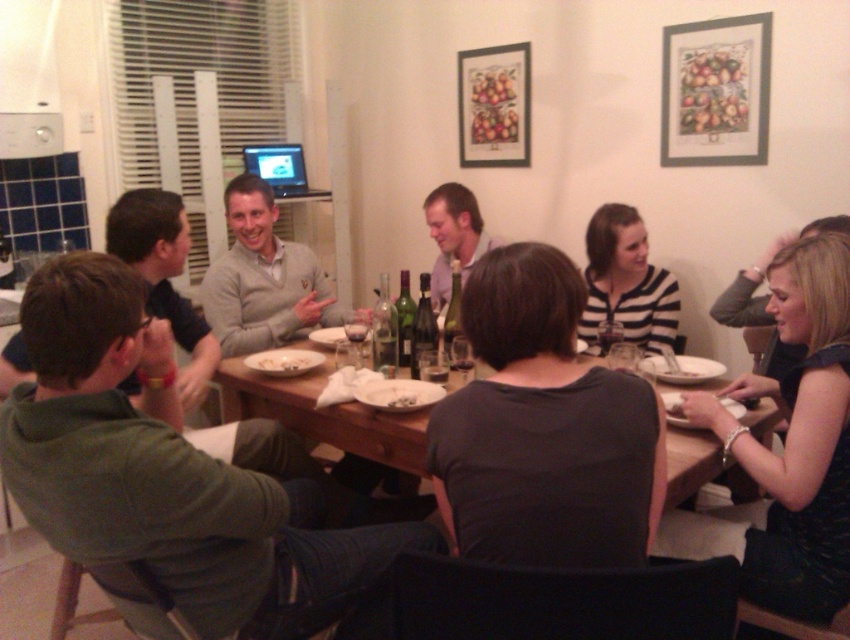
Question: Is the position of black dress at lower right more distant than that of striped cotton shirt at center?

Choices:
 (A) no
 (B) yes

Answer: (A)

Question: Which of these objects is positioned closest to the white matte plate at center?

Choices:
 (A) green cotton shirt at left
 (B) black dress at lower right

Answer: (A)

Question: From the image, what is the correct spatial relationship of gray sweater at center in relation to green matte shirt at left?

Choices:
 (A) below
 (B) above

Answer: (B)

Question: Estimate the real-world distances between objects in this image. Which object is closer to the white paper plate at center?

Choices:
 (A) green matte shirt at left
 (B) dark gray shirt at center
 (C) green cotton shirt at lower left

Answer: (C)

Question: Estimate the real-world distances between objects in this image. Which object is farther from the white matte plate at center?

Choices:
 (A) dark gray shirt at center
 (B) wooden framed print at upper right

Answer: (B)

Question: Can you confirm if wooden framed print at upper right is positioned to the left of striped cotton shirt at center?

Choices:
 (A) no
 (B) yes

Answer: (A)